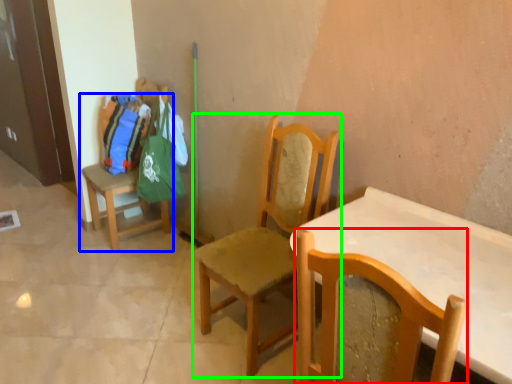
Question: Which object is the closest to the chair (highlighted by a red box)? Choose among these: chair (highlighted by a blue box) or chair (highlighted by a green box).

Choices:
 (A) chair
 (B) chair

Answer: (B)